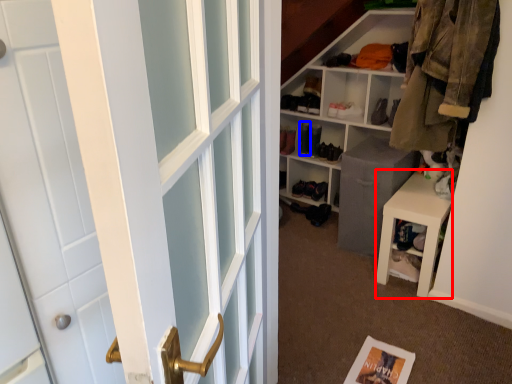
Question: Which point is further to the camera, stool (highlighted by a red box) or shoe (highlighted by a blue box)?

Choices:
 (A) stool
 (B) shoe

Answer: (B)